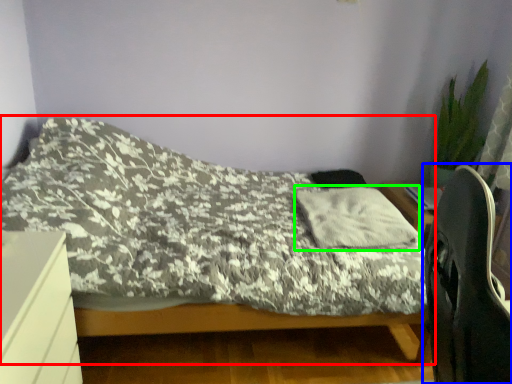
Question: Which is farther away from bed (highlighted by a red box)? computer chair (highlighted by a blue box) or pillow (highlighted by a green box)?

Choices:
 (A) computer chair
 (B) pillow

Answer: (A)